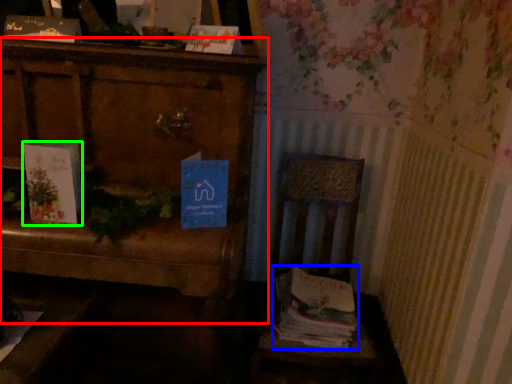
Question: Considering the real-world distances, which object is closest to furniture (highlighted by a red box)? magazine (highlighted by a blue box) or book (highlighted by a green box).

Choices:
 (A) magazine
 (B) book

Answer: (B)